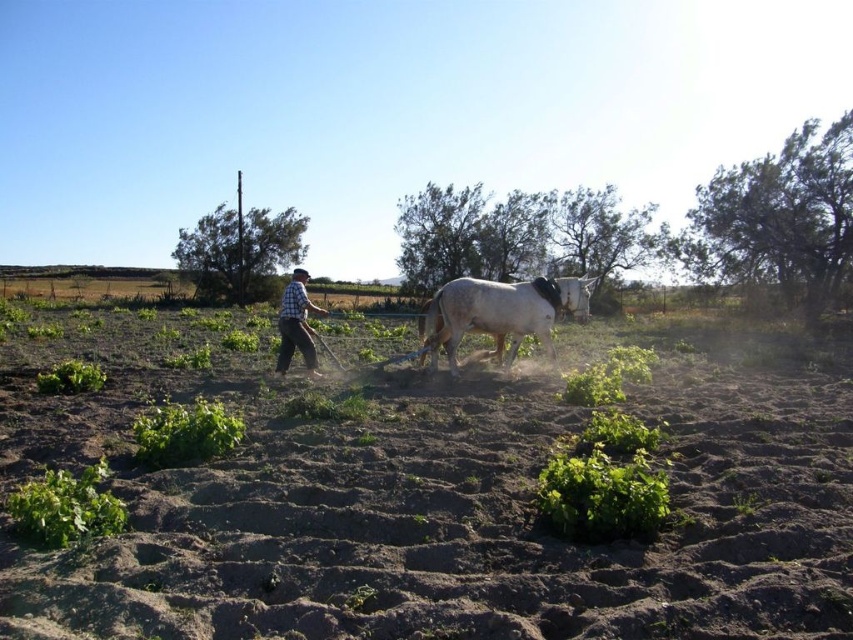
You are standing at the edge of the field and want to reach the brown soil at center without getting too close to the checkered fabric shirt at center. What is the minimum distance you need to walk to avoid the shirt?

The minimum distance you need to walk is 4.82 meters away from the checkered fabric shirt at center to reach the brown soil at center.

You are a farmer planning to plant seeds in the brown soil at center. Based on the scene description, where exactly should you focus your planting efforts?

The brown soil at center is located at point (433, 509), so you should focus your planting efforts there.

Based on the scene description, where is the white matte horse at center located in terms of coordinates?

The white matte horse at center is located at coordinates point [502,310].